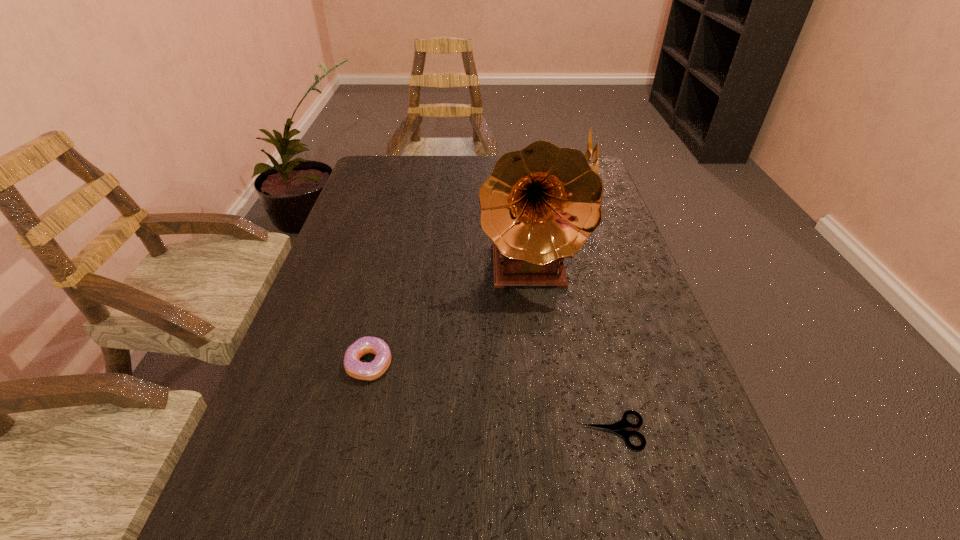
Image resolution: width=960 pixels, height=540 pixels. I want to click on vacant area that lies between the third farthest object and the shortest object, so click(492, 397).

Select which object appears as the third closest to the farthest object. Please provide its 2D coordinates. Your answer should be formatted as a tuple, i.e. [(x, y)], where the tuple contains the x and y coordinates of a point satisfying the conditions above.

[(376, 368)]

Identify which object is located as the third nearest to the phonograph_record. Please provide its 2D coordinates. Your answer should be formatted as a tuple, i.e. [(x, y)], where the tuple contains the x and y coordinates of a point satisfying the conditions above.

[(618, 427)]

This screenshot has height=540, width=960. I want to click on free region that satisfies the following two spatial constraints: 1. on the horn of the nearest object; 2. on the right side of the tallest object, so click(549, 431).

This screenshot has height=540, width=960. I want to click on vacant region that satisfies the following two spatial constraints: 1. on the horn of the shears; 2. on the left side of the tallest object, so click(x=549, y=431).

The height and width of the screenshot is (540, 960). I want to click on free location that satisfies the following two spatial constraints: 1. on the front-facing side of the earphone; 2. on the front side of the second shortest object, so click(654, 364).

Identify the location of vacant position in the image that satisfies the following two spatial constraints: 1. on the front-facing side of the earphone; 2. on the front side of the second nearest object. The height and width of the screenshot is (540, 960). (654, 364).

The width and height of the screenshot is (960, 540). What are the coordinates of `vacant space that satisfies the following two spatial constraints: 1. on the horn of the nearest object; 2. on the right side of the phonograph_record` in the screenshot? It's located at (549, 431).

Find the location of `free space that satisfies the following two spatial constraints: 1. on the front-facing side of the third shortest object; 2. on the front side of the third farthest object`. free space that satisfies the following two spatial constraints: 1. on the front-facing side of the third shortest object; 2. on the front side of the third farthest object is located at coordinates (654, 364).